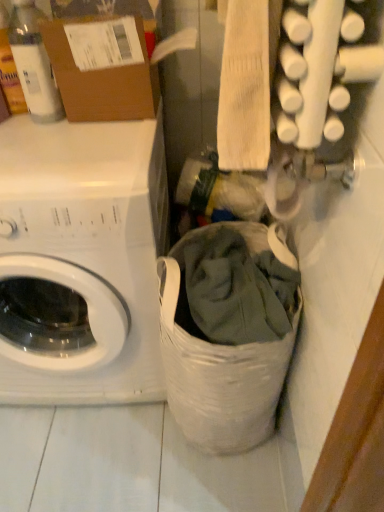
Question: From the image's perspective, is translucent plastic bottle at upper left above or below white fabric laundry basket at lower center?

Choices:
 (A) above
 (B) below

Answer: (A)

Question: In the image, is translucent plastic bottle at upper left on the left side or the right side of white fabric laundry basket at lower center?

Choices:
 (A) left
 (B) right

Answer: (A)

Question: Considering the real-world distances, which object is closest to the translucent plastic bottle at upper left?

Choices:
 (A) white fabric laundry basket at lower center
 (B) white matte washing machine at left
 (C) brown cardboard box at upper left

Answer: (C)

Question: Which object is positioned farthest from the white fabric laundry basket at lower center?

Choices:
 (A) translucent plastic bottle at upper left
 (B) brown cardboard box at upper left
 (C) white matte washing machine at left

Answer: (A)